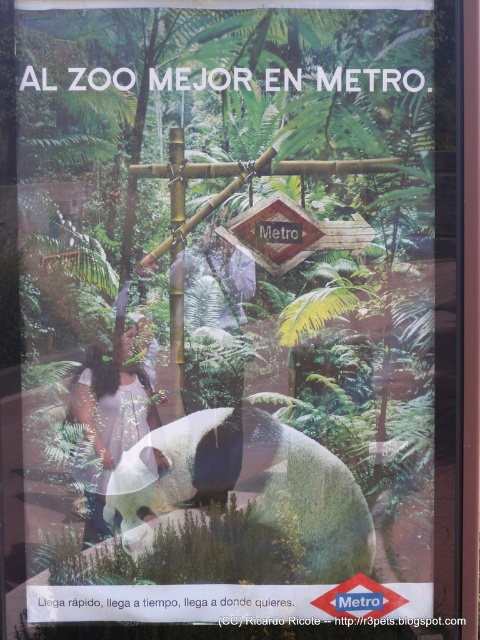
Which is above, white fur panda at center or white cotton dress at lower left?

Positioned higher is white cotton dress at lower left.

Who is positioned more to the right, white fur panda at center or white cotton dress at lower left?

Positioned to the right is white fur panda at center.

Is point (282, 449) farther from camera compared to point (91, 362)?

Yes, it is behind point (91, 362).

This screenshot has width=480, height=640. What are the coordinates of `white fur panda at center` in the screenshot? It's located at (252, 484).